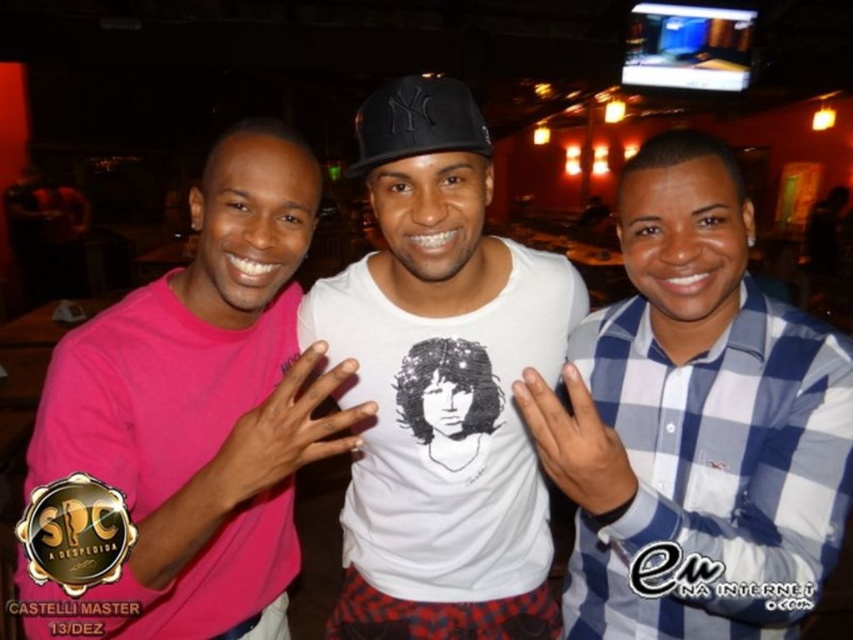
You are standing in the dimly lit room where the three people are posing. You want to move from your current position to the point marked as point (123,563). However, there is an obstacle at point (454,132). Will you encounter this obstacle before reaching your destination?

Yes, you will encounter the obstacle at point (454,132) before reaching point (123,563) because point (123,563) is in front of point (454,132).